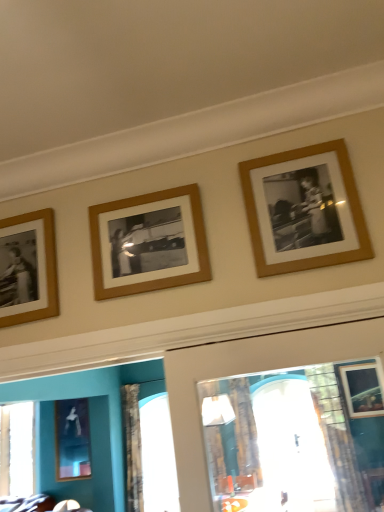
Question: From the image's perspective, is wooden frame at center, placed as the 2th picture frame when sorted from right to left, located above metallic silver frame at lower left, acting as the fourth picture frame starting from the front?

Choices:
 (A) yes
 (B) no

Answer: (A)

Question: Can you confirm if wooden frame at center, which is the 2th picture frame in front-to-back order, is shorter than metallic silver frame at lower left, the 1th picture frame in the bottom-to-top sequence?

Choices:
 (A) yes
 (B) no

Answer: (A)

Question: Is wooden frame at center, the third picture frame when ordered from back to front, far away from metallic silver frame at lower left, which is counted as the fourth picture frame, starting from the top?

Choices:
 (A) yes
 (B) no

Answer: (A)

Question: Is wooden frame at center, which is the 2th picture frame in front-to-back order, looking in the opposite direction of metallic silver frame at lower left, acting as the fourth picture frame starting from the front?

Choices:
 (A) no
 (B) yes

Answer: (A)

Question: Is wooden frame at center, placed as the 2th picture frame when sorted from top to bottom, outside metallic silver frame at lower left, placed as the fourth picture frame when sorted from right to left?

Choices:
 (A) yes
 (B) no

Answer: (A)

Question: Does point (99, 298) appear closer or farther from the camera than point (370, 246)?

Choices:
 (A) closer
 (B) farther

Answer: (B)

Question: From a real-world perspective, is wooden frame at center, which is the 2th picture frame in front-to-back order, physically located above or below wooden photo frame at upper right, which appears as the 1th picture frame when viewed from the top?

Choices:
 (A) above
 (B) below

Answer: (B)

Question: Considering their positions, is wooden frame at center, the third picture frame when ordered from left to right, located in front of or behind wooden photo frame at upper right, positioned as the 4th picture frame in bottom-to-top order?

Choices:
 (A) behind
 (B) front

Answer: (A)

Question: Considering the positions of wooden frame at center, placed as the 2th picture frame when sorted from right to left, and wooden photo frame at upper right, acting as the 1th picture frame starting from the front, in the image, is wooden frame at center, placed as the 2th picture frame when sorted from right to left, taller or shorter than wooden photo frame at upper right, acting as the 1th picture frame starting from the front,?

Choices:
 (A) tall
 (B) short

Answer: (B)

Question: Relative to wooden frame at center, the third picture frame when ordered from left to right, is wooden photo frame at left, placed as the second picture frame when sorted from back to front, in front or behind?

Choices:
 (A) behind
 (B) front

Answer: (A)

Question: Looking at their shapes, would you say wooden photo frame at left, marked as the second picture frame in a bottom-to-top arrangement, is wider or thinner than wooden frame at center, the third picture frame when ordered from back to front?

Choices:
 (A) wide
 (B) thin

Answer: (A)

Question: Considering the positions of wooden photo frame at left, acting as the 2th picture frame starting from the left, and wooden frame at center, the third picture frame when ordered from left to right, in the image, is wooden photo frame at left, acting as the 2th picture frame starting from the left, taller or shorter than wooden frame at center, the third picture frame when ordered from left to right,?

Choices:
 (A) short
 (B) tall

Answer: (B)

Question: Is wooden photo frame at left, placed as the second picture frame when sorted from back to front, inside the boundaries of wooden frame at center, placed as the 2th picture frame when sorted from right to left, or outside?

Choices:
 (A) outside
 (B) inside

Answer: (A)

Question: Is metallic silver frame at lower left, which is counted as the fourth picture frame, starting from the top, in front of or behind wooden photo frame at left, the 3th picture frame from the top, in the image?

Choices:
 (A) front
 (B) behind

Answer: (B)

Question: Looking at their shapes, would you say metallic silver frame at lower left, which is counted as the fourth picture frame, starting from the top, is wider or thinner than wooden photo frame at left, which is counted as the third picture frame, starting from the right?

Choices:
 (A) thin
 (B) wide

Answer: (B)